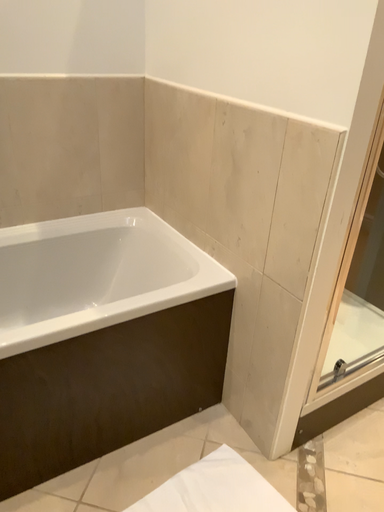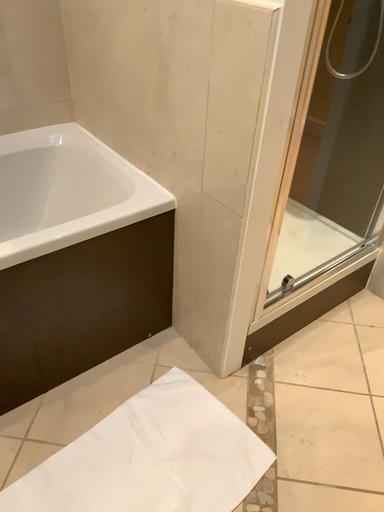
Question: How did the camera likely rotate when shooting the video?

Choices:
 (A) rotated upward
 (B) rotated downward

Answer: (B)